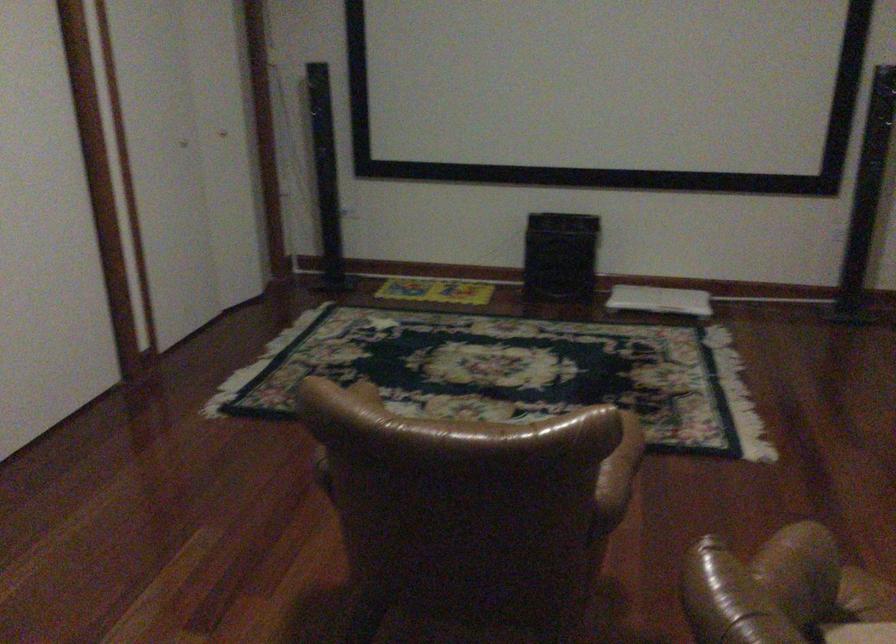
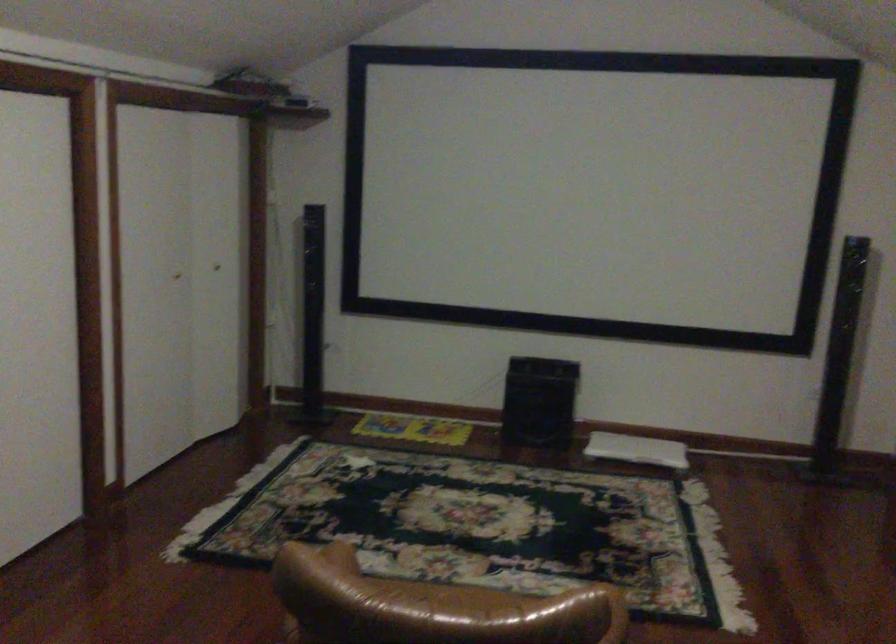
Question: The first image is from the beginning of the video and the second image is from the end. How did the camera likely rotate when shooting the video?

Choices:
 (A) Left
 (B) Right
 (C) Up
 (D) Down

Answer: (C)